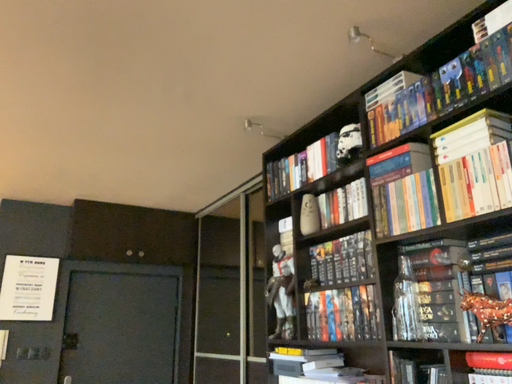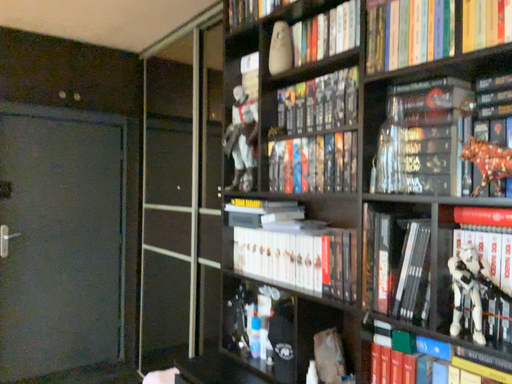
Question: How did the camera likely rotate when shooting the video?

Choices:
 (A) rotated downward
 (B) rotated upward

Answer: (A)